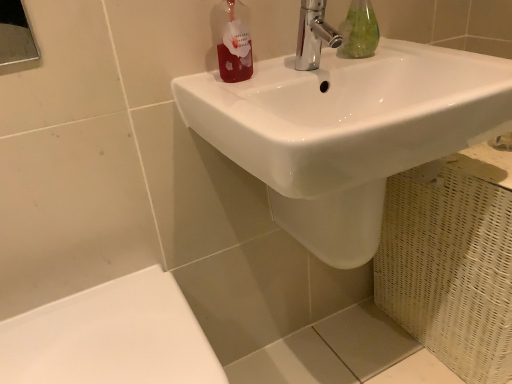
You are a GUI agent. You are given a task and a screenshot of the screen. Output one action in this format:
    pyautogui.click(x=<x>, y=<y>)
    Task: Click on the free space to the left of chrome/metallic faucet at upper center
    
    Given the screenshot: What is the action you would take?
    pyautogui.click(x=264, y=80)